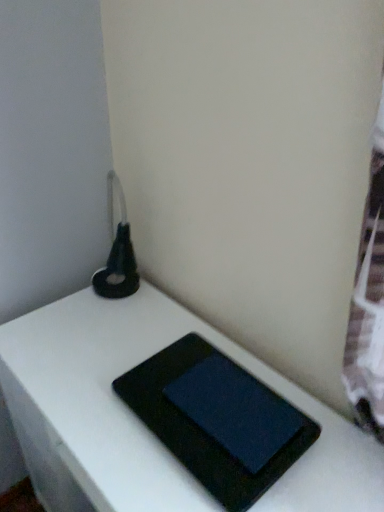
The height and width of the screenshot is (512, 384). Describe the element at coordinates (235, 411) in the screenshot. I see `matte black tablet at center, which ranks as the 1th tablet computer in top-to-bottom order` at that location.

What do you see at coordinates (217, 420) in the screenshot? This screenshot has height=512, width=384. I see `black matte tablet at center, the 2th tablet computer in the top-to-bottom sequence` at bounding box center [217, 420].

Identify the location of matte black tablet at center, which ranks as the 1th tablet computer in top-to-bottom order. The width and height of the screenshot is (384, 512). (235, 411).

From the image's perspective, who appears lower, black matte tablet at center, placed as the 1th tablet computer when sorted from bottom to top, or black matte book at center?

black matte book at center.

Where is `table to the left of black matte tablet at center, placed as the 1th tablet computer when sorted from bottom to top`? The height and width of the screenshot is (512, 384). table to the left of black matte tablet at center, placed as the 1th tablet computer when sorted from bottom to top is located at coordinates (143, 424).

Is point (212, 393) closer or farther from the camera than point (58, 321)?

Clearly, point (212, 393) is closer to the camera than point (58, 321).

From the image's perspective, is black matte book at center above or below matte black tablet at center, which ranks as the 1th tablet computer in top-to-bottom order?

black matte book at center is below matte black tablet at center, which ranks as the 1th tablet computer in top-to-bottom order.

Is black matte book at center facing away from matte black tablet at center, which ranks as the 1th tablet computer in top-to-bottom order?

No.

From a real-world perspective, relative to matte black tablet at center, acting as the 2th tablet computer starting from the bottom, is black matte book at center vertically above or below?

black matte book at center is below matte black tablet at center, acting as the 2th tablet computer starting from the bottom.

Considering the relative positions of matte black tablet at center, acting as the 2th tablet computer starting from the bottom, and black matte tablet at center, the 2th tablet computer in the top-to-bottom sequence, in the image provided, is matte black tablet at center, acting as the 2th tablet computer starting from the bottom, to the left of black matte tablet at center, the 2th tablet computer in the top-to-bottom sequence, from the viewer's perspective?

Incorrect, matte black tablet at center, acting as the 2th tablet computer starting from the bottom, is not on the left side of black matte tablet at center, the 2th tablet computer in the top-to-bottom sequence.

Which of these two, matte black tablet at center, which ranks as the 1th tablet computer in top-to-bottom order, or black matte tablet at center, placed as the 1th tablet computer when sorted from bottom to top, is smaller?

matte black tablet at center, which ranks as the 1th tablet computer in top-to-bottom order.

Considering the positions of points (231, 453) and (189, 459), is point (231, 453) farther from camera compared to point (189, 459)?

No, it is in front of (189, 459).

Is matte black tablet at center, which ranks as the 1th tablet computer in top-to-bottom order, oriented away from black matte tablet at center, the 2th tablet computer in the top-to-bottom sequence?

No, matte black tablet at center, which ranks as the 1th tablet computer in top-to-bottom order,'s orientation is not away from black matte tablet at center, the 2th tablet computer in the top-to-bottom sequence.

Which of these two, matte black tablet at center, which ranks as the 1th tablet computer in top-to-bottom order, or black matte book at center, is bigger?

black matte book at center is bigger.

Is matte black tablet at center, acting as the 2th tablet computer starting from the bottom, not close to black matte book at center?

No, matte black tablet at center, acting as the 2th tablet computer starting from the bottom, is not far from black matte book at center.

Which object is thinner, black matte book at center or black matte tablet at center, placed as the 1th tablet computer when sorted from bottom to top?

Thinner between the two is black matte tablet at center, placed as the 1th tablet computer when sorted from bottom to top.

Is black matte book at center oriented away from black matte tablet at center, the 2th tablet computer in the top-to-bottom sequence?

No.

Would you consider black matte book at center to be distant from black matte tablet at center, the 2th tablet computer in the top-to-bottom sequence?

No, there isn't a large distance between black matte book at center and black matte tablet at center, the 2th tablet computer in the top-to-bottom sequence.

From the image's perspective, between black matte book at center and black matte tablet at center, the 2th tablet computer in the top-to-bottom sequence, who is located below?

From the image's view, black matte book at center is below.

Which is in front, black matte tablet at center, placed as the 1th tablet computer when sorted from bottom to top, or matte black tablet at center, acting as the 2th tablet computer starting from the bottom?

black matte tablet at center, placed as the 1th tablet computer when sorted from bottom to top.

Considering the sizes of black matte tablet at center, placed as the 1th tablet computer when sorted from bottom to top, and matte black tablet at center, acting as the 2th tablet computer starting from the bottom, in the image, is black matte tablet at center, placed as the 1th tablet computer when sorted from bottom to top, bigger or smaller than matte black tablet at center, acting as the 2th tablet computer starting from the bottom,?

In the image, black matte tablet at center, placed as the 1th tablet computer when sorted from bottom to top, appears to be larger than matte black tablet at center, acting as the 2th tablet computer starting from the bottom.

How different are the orientations of black matte tablet at center, the 2th tablet computer in the top-to-bottom sequence, and matte black tablet at center, which ranks as the 1th tablet computer in top-to-bottom order, in degrees?

0.257 degrees separate the facing orientations of black matte tablet at center, the 2th tablet computer in the top-to-bottom sequence, and matte black tablet at center, which ranks as the 1th tablet computer in top-to-bottom order.

Is point (240, 403) positioned behind point (298, 432)?

Yes, point (240, 403) is farther from viewer.

Which tablet computer is the 1st one when counting from the right side of the black matte book at center? Please provide its 2D coordinates.

[(217, 420)]

There is a black matte book at center. At what (x,y) coordinates should I click in order to perform the action: click on the 2nd tablet computer above it (from a real-world perspective). Please return your answer as a coordinate pair (x, y). The height and width of the screenshot is (512, 384). Looking at the image, I should click on (235, 411).

Considering their positions, is matte black tablet at center, which ranks as the 1th tablet computer in top-to-bottom order, positioned closer to black matte book at center than black matte tablet at center, the 2th tablet computer in the top-to-bottom sequence?

black matte tablet at center, the 2th tablet computer in the top-to-bottom sequence, lies closer to black matte book at center than the other object.

Looking at the image, which one is located closer to black matte book at center, black matte tablet at center, placed as the 1th tablet computer when sorted from bottom to top, or matte black tablet at center, acting as the 2th tablet computer starting from the bottom?

black matte tablet at center, placed as the 1th tablet computer when sorted from bottom to top, is positioned closer to the anchor black matte book at center.

When comparing their distances from black matte tablet at center, the 2th tablet computer in the top-to-bottom sequence, does black matte book at center or matte black tablet at center, acting as the 2th tablet computer starting from the bottom, seem further?

black matte book at center.

Which object lies nearer to the anchor point black matte tablet at center, the 2th tablet computer in the top-to-bottom sequence, matte black tablet at center, which ranks as the 1th tablet computer in top-to-bottom order, or black matte book at center?

Based on the image, matte black tablet at center, which ranks as the 1th tablet computer in top-to-bottom order, appears to be nearer to black matte tablet at center, the 2th tablet computer in the top-to-bottom sequence.

Considering their positions, is black matte book at center positioned closer to matte black tablet at center, which ranks as the 1th tablet computer in top-to-bottom order, than black matte tablet at center, the 2th tablet computer in the top-to-bottom sequence?

black matte tablet at center, the 2th tablet computer in the top-to-bottom sequence, is positioned closer to the anchor matte black tablet at center, which ranks as the 1th tablet computer in top-to-bottom order.

Considering their positions, is black matte tablet at center, placed as the 1th tablet computer when sorted from bottom to top, positioned closer to matte black tablet at center, acting as the 2th tablet computer starting from the bottom, than black matte book at center?

Among the two, black matte tablet at center, placed as the 1th tablet computer when sorted from bottom to top, is located nearer to matte black tablet at center, acting as the 2th tablet computer starting from the bottom.

In order to click on tablet computer that lies between matte black tablet at center, which ranks as the 1th tablet computer in top-to-bottom order, and black matte book at center from top to bottom in this screenshot , I will do `click(217, 420)`.